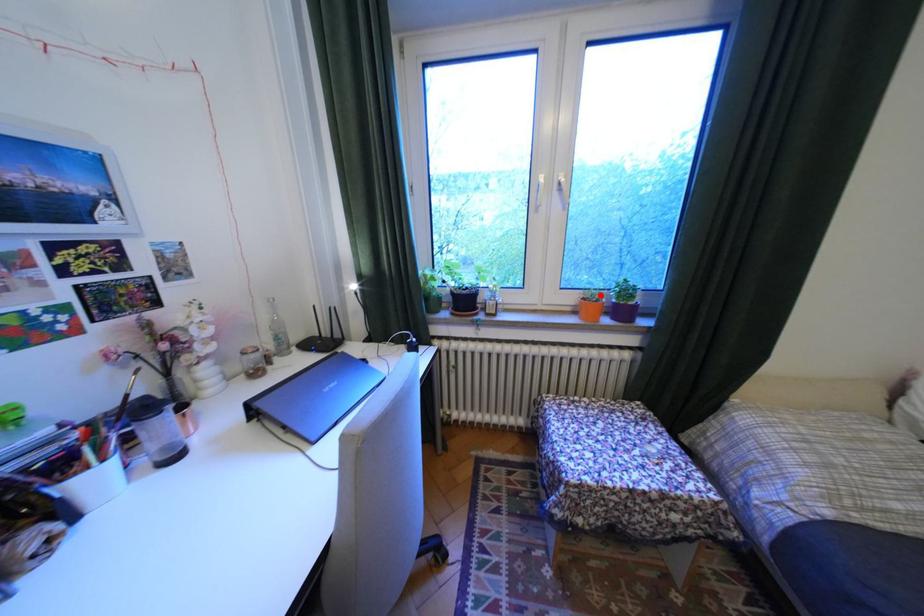
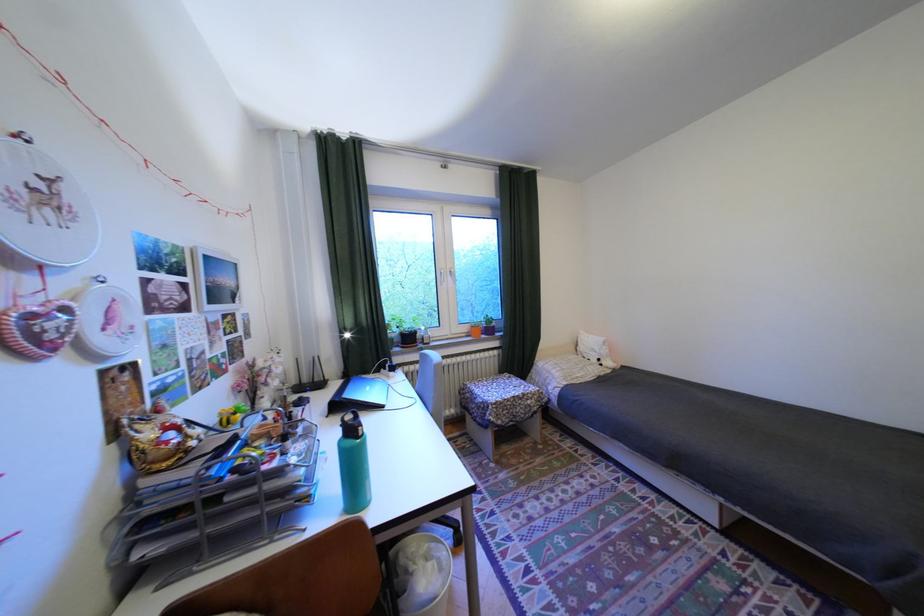
In the second image, find the point that corresponds to the highlighted location in the first image.

(485, 325)